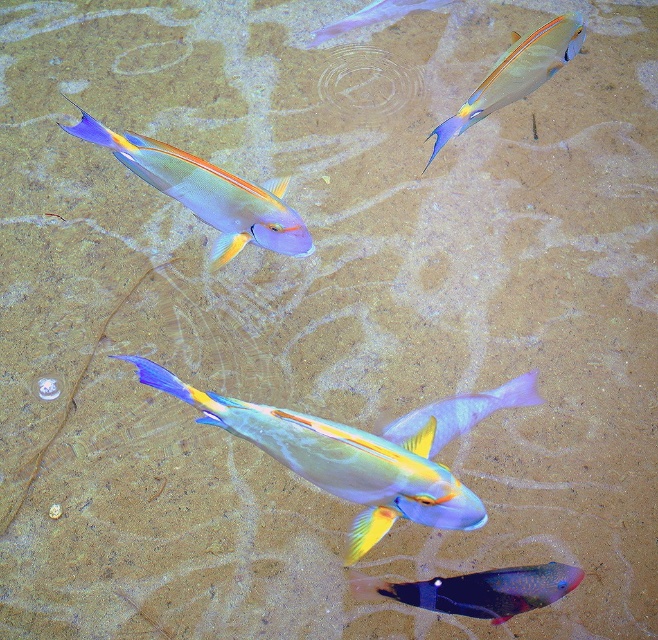
Consider the image. Who is positioned more to the left, shiny metallic fish at center or translucent purple fish at center?

shiny metallic fish at center

Who is higher up, shiny metallic fish at center or translucent purple fish at center?

translucent purple fish at center is higher up.

Measure the distance between point (x=255, y=435) and camera.

Point (x=255, y=435) and camera are 3.66 feet apart.

The height and width of the screenshot is (640, 658). What are the coordinates of `shiny metallic fish at center` in the screenshot? It's located at (340, 461).

Can you confirm if shiny metallic fish at center is wider than matte blue fish at upper left?

Yes.

Which is in front, point (180, 390) or point (157, 180)?

Point (180, 390)

The image size is (658, 640). What do you see at coordinates (340, 461) in the screenshot? I see `shiny metallic fish at center` at bounding box center [340, 461].

I want to click on shiny metallic fish at center, so click(x=340, y=461).

Is shiny metallic fish at center above translucent blue fish at lower center?

Correct, shiny metallic fish at center is located above translucent blue fish at lower center.

Is point (291, 422) positioned behind point (532, 580)?

That is False.

At what (x,y) coordinates should I click in order to perform the action: click on shiny metallic fish at center. Please return your answer as a coordinate pair (x, y). Looking at the image, I should click on (340, 461).